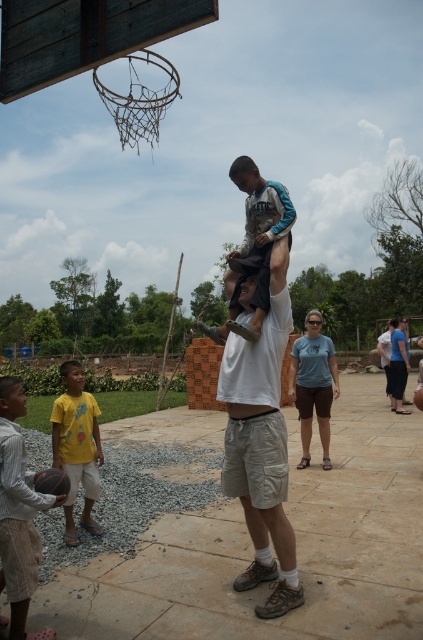
Is striped cotton shirt at lower left to the right of rubber textured basketball at lower left from the viewer's perspective?

Incorrect, striped cotton shirt at lower left is not on the right side of rubber textured basketball at lower left.

Measure the distance between striped cotton shirt at lower left and rubber textured basketball at lower left.

The distance of striped cotton shirt at lower left from rubber textured basketball at lower left is 12.62 inches.

Which is in front, point (18, 397) or point (68, 481)?

Point (18, 397) is more forward.

Locate an element on the screen. The height and width of the screenshot is (640, 423). striped cotton shirt at lower left is located at coordinates (19, 513).

Does white cotton t-shirt at center appear over striped cotton shirt at lower left?

Correct, white cotton t-shirt at center is located above striped cotton shirt at lower left.

Between point (263, 570) and point (38, 563), which one is positioned in front?

Point (38, 563)

In order to click on white cotton t-shirt at center in this screenshot , I will do `click(261, 445)`.

Can you confirm if white cotton t-shirt at center is shorter than blue cotton shirt at center?

Incorrect, white cotton t-shirt at center's height does not fall short of blue cotton shirt at center's.

This screenshot has height=640, width=423. In order to click on white cotton t-shirt at center in this screenshot , I will do `click(261, 445)`.

Locate an element on the screen. Image resolution: width=423 pixels, height=640 pixels. white cotton t-shirt at center is located at coordinates (261, 445).